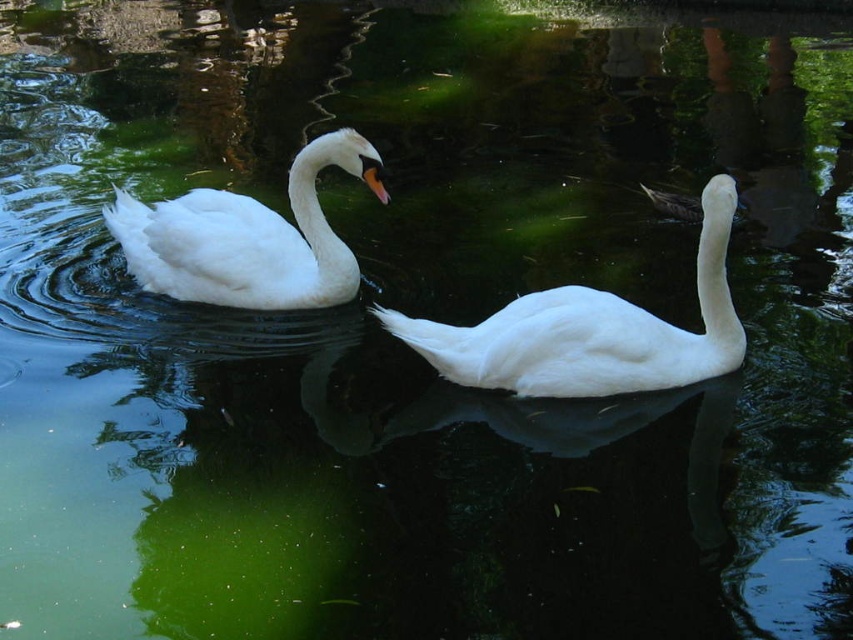
From the picture: You are observing two points in the image of the swans. From your perspective, which point, point (x=547, y=355) or point (x=136, y=278), is nearer to you?

Point (x=547, y=355) is closer to the viewer than point (x=136, y=278).

You are a wildlife photographer aiming to capture a closeup shot of both the white matte swan at center and the white glossy swan at upper left. Your camera has a maximum focus range of 3 feet. Can you capture both swans in a single shot without moving your position?

The distance between the white matte swan at center and the white glossy swan at upper left is 3.54 feet. Since your camera can only focus within 3 feet, you cannot capture both swans in a single shot without moving your position.

You are a photographer trying to capture the white matte swan at center and the white glossy swan at upper left. If you want to focus on the swan that is closer to you, which one should you choose?

The white matte swan at center is in front of the white glossy swan at upper left, so it is closer to you. Therefore, you should focus on the white matte swan at center to capture the one that is closer.